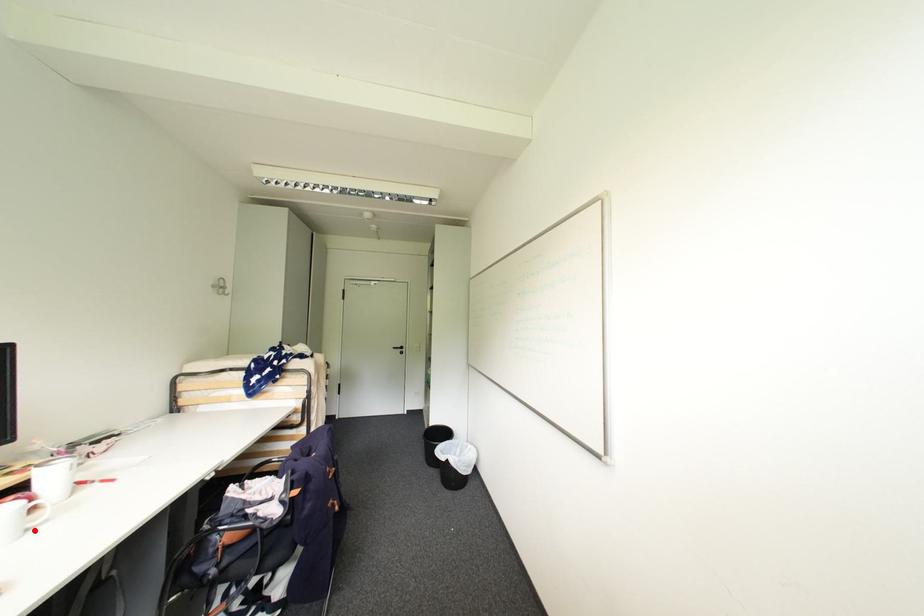
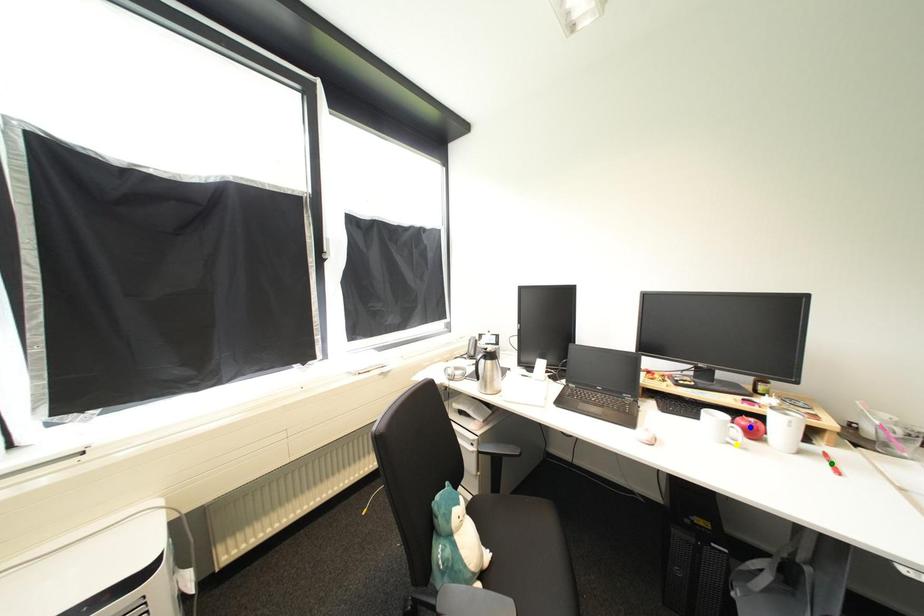
Question: I am providing you with two images of the same scene from different viewpoints. A red point is marked on the first image. You are given multiple points on the second image. Which point in image 2 is actually the same real-world point as the red point in image 1?

Choices:
 (A) blue point
 (B) yellow point
 (C) green point

Answer: (B)